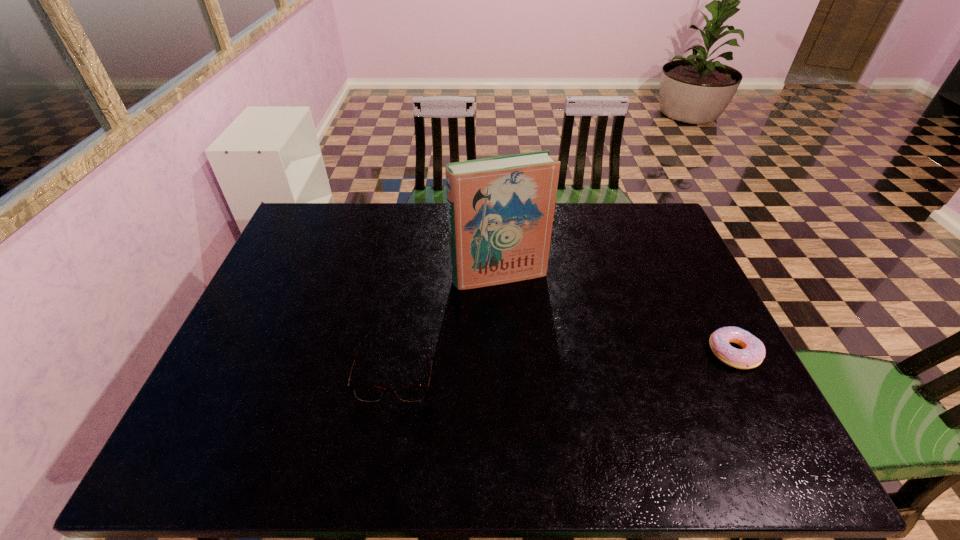
You are a GUI agent. You are given a task and a screenshot of the screen. Output one action in this format:
    pyautogui.click(x=<x>, y=<y>)
    Task: Click on the object situated at the near edge
    This screenshot has width=960, height=540.
    Given the screenshot: What is the action you would take?
    pyautogui.click(x=371, y=393)

Where is `object at the right edge`? This screenshot has height=540, width=960. object at the right edge is located at coordinates (753, 352).

Where is `free space at the far edge`? This screenshot has width=960, height=540. free space at the far edge is located at coordinates (573, 207).

In the image, there is a desktop. At what (x,y) coordinates should I click in order to perform the action: click on free space at the near edge. Please return your answer as a coordinate pair (x, y). The image size is (960, 540). Looking at the image, I should click on (450, 416).

This screenshot has height=540, width=960. Find the location of `vacant space at the left edge of the desktop`. vacant space at the left edge of the desktop is located at coordinates (291, 349).

You are a GUI agent. You are given a task and a screenshot of the screen. Output one action in this format:
    pyautogui.click(x=<x>, y=<y>)
    Task: Click on the vacant position at the right edge of the desktop
    This screenshot has width=960, height=540.
    Given the screenshot: What is the action you would take?
    pyautogui.click(x=659, y=255)

The image size is (960, 540). In order to click on vacant area at the far left corner of the desktop in this screenshot , I will do `click(327, 214)`.

In the image, there is a desktop. Where is `vacant space at the near left corner`? This screenshot has width=960, height=540. vacant space at the near left corner is located at coordinates (223, 388).

The image size is (960, 540). I want to click on vacant area that lies between the leftmost object and the rightmost object, so click(x=565, y=360).

Locate an element on the screen. The width and height of the screenshot is (960, 540). empty space that is in between the rightmost object and the second object from right to left is located at coordinates (616, 314).